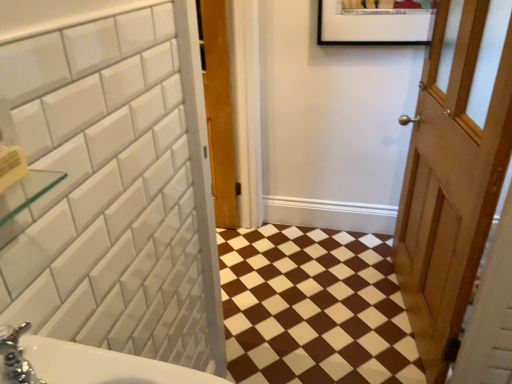
The width and height of the screenshot is (512, 384). Find the location of `free point above brown glossy tile at center (from a real-world perspective)`. free point above brown glossy tile at center (from a real-world perspective) is located at coordinates (320, 284).